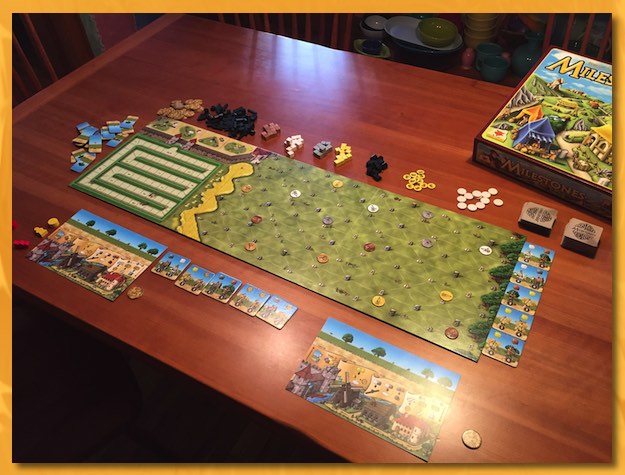
Locate an element on the screen. board game box is located at coordinates (556, 108).